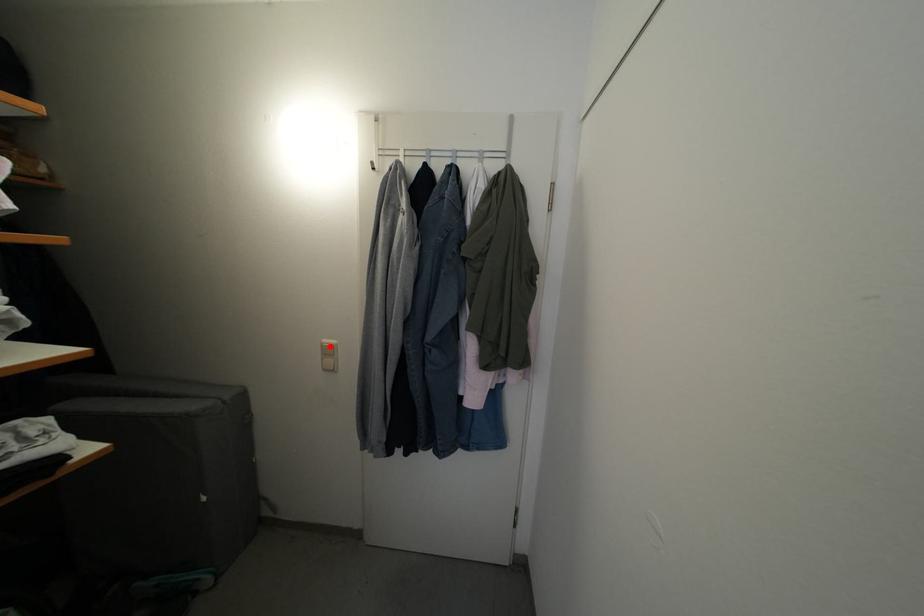
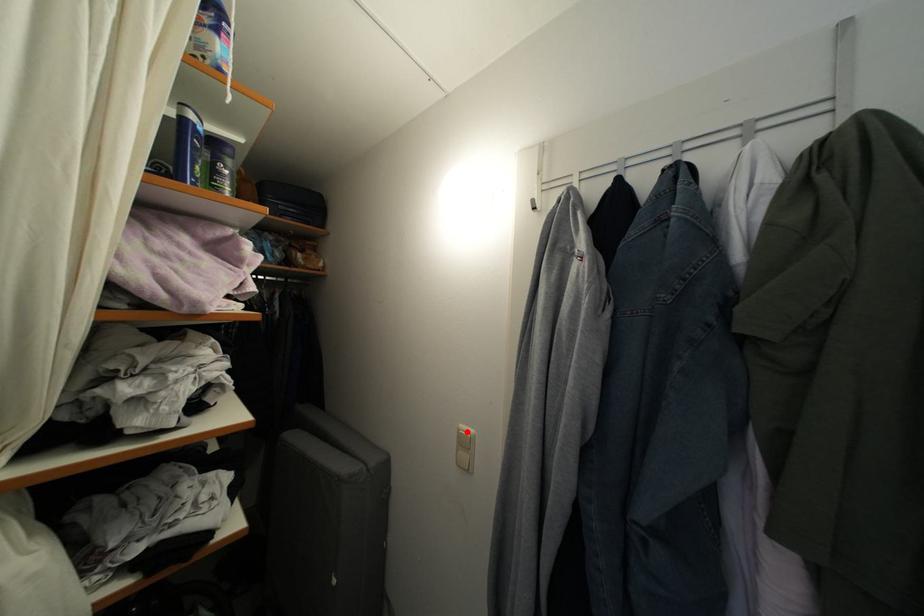
I am providing you with two images of the same scene from different viewpoints. A red point is marked on the first image and another point is marked on the second image. Is the red point in image1 aligned with the point shown in image2?

Yes